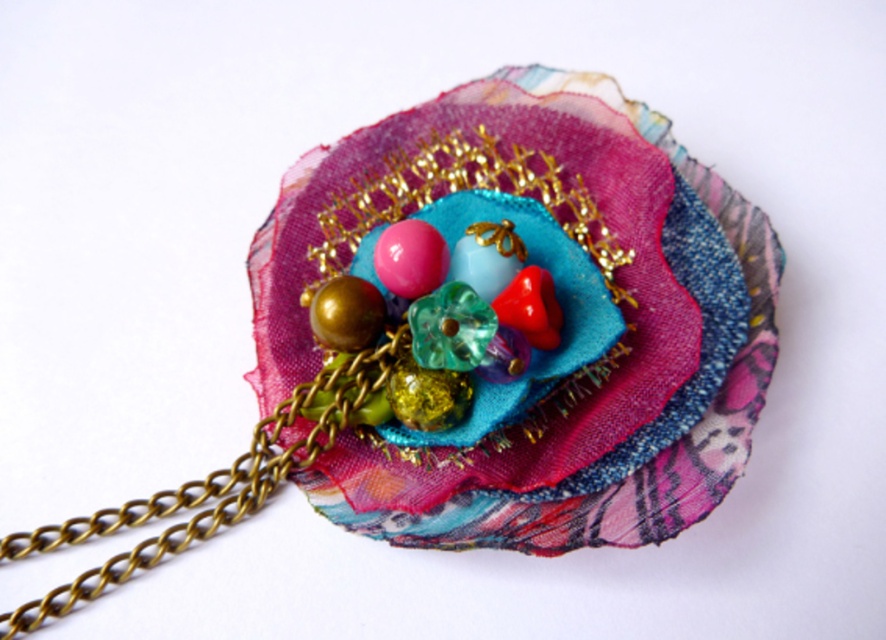
Consider the image. Between textile flower at center and translucent green glass bead at center, which one is positioned higher?

textile flower at center

Which is in front, point (688, 464) or point (487, 321)?

Point (688, 464)

Does point (578, 516) lie in front of point (443, 362)?

That is True.

This screenshot has width=886, height=640. Identify the location of textile flower at center. (657, 454).